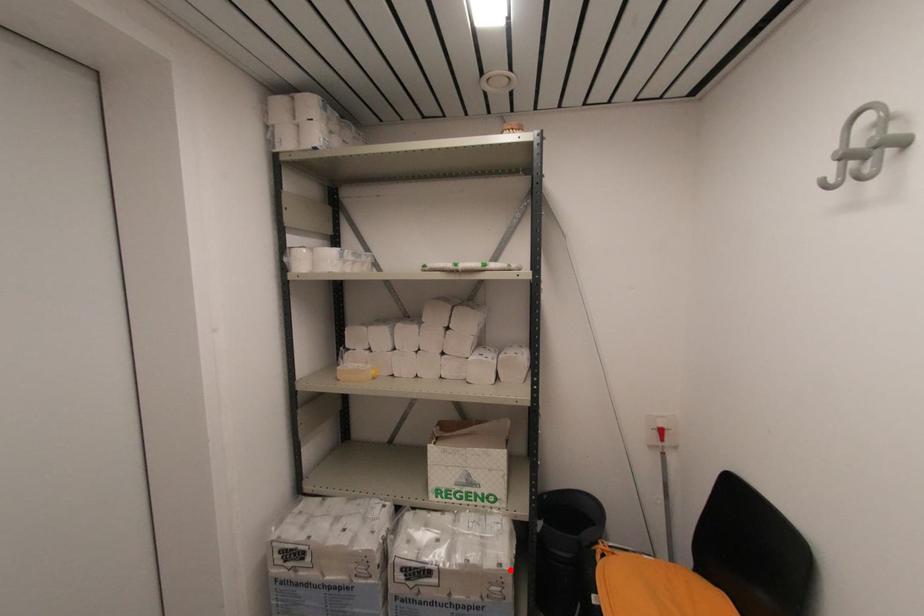
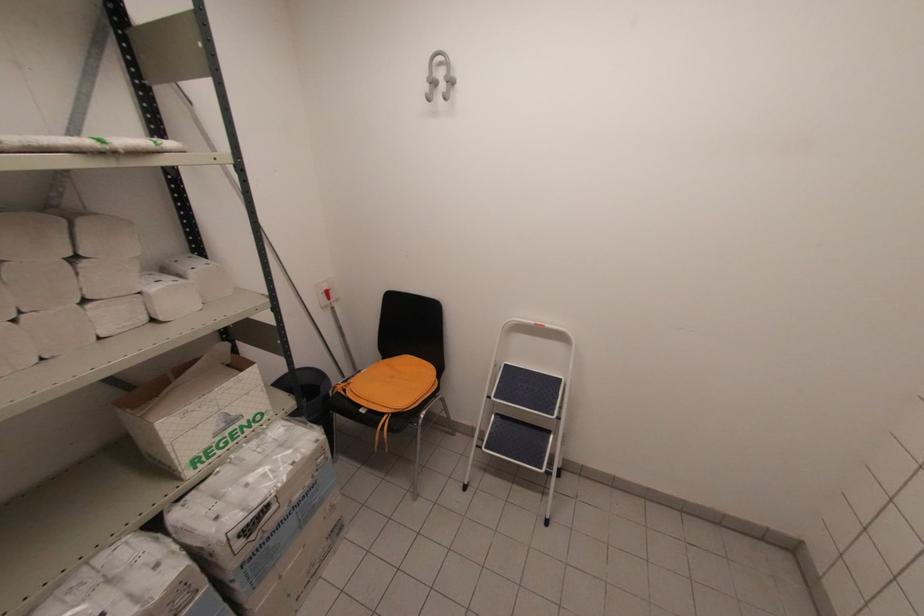
The point at the highlighted location is marked in the first image. Where is the corresponding point in the second image?

(325, 437)